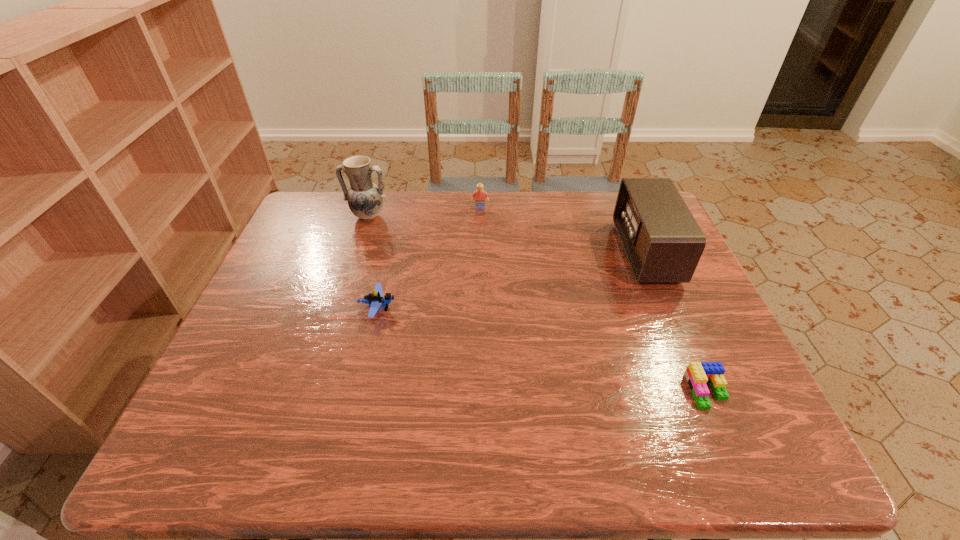
Find the location of a particular element. The height and width of the screenshot is (540, 960). free location located on the front-facing side of the radio receiver is located at coordinates (510, 253).

Find the location of a particular element. Image resolution: width=960 pixels, height=540 pixels. vacant region located on the front-facing side of the radio receiver is located at coordinates (534, 253).

Identify the location of vacant position located 0.170m on the front-facing side of the second Lego from right to left. This screenshot has height=540, width=960. (480, 244).

Where is `free location located 0.180m on the front-facing side of the leftmost Lego`? The image size is (960, 540). free location located 0.180m on the front-facing side of the leftmost Lego is located at coordinates (469, 309).

At what (x,y) coordinates should I click in order to perform the action: click on vacant space located 0.220m on the back of the shortest Lego. Please return your answer as a coordinate pair (x, y). Looking at the image, I should click on (668, 300).

At what (x,y) coordinates should I click in order to perform the action: click on pottery present at the far edge. Please return your answer as a coordinate pair (x, y). Image resolution: width=960 pixels, height=540 pixels. Looking at the image, I should click on (365, 199).

This screenshot has height=540, width=960. I want to click on radio receiver located at the far edge, so click(x=663, y=243).

I want to click on Lego present at the far edge, so click(479, 195).

Where is `object that is at the left edge`? The image size is (960, 540). object that is at the left edge is located at coordinates (365, 199).

Find the location of `radio receiver positioned at the right edge`. radio receiver positioned at the right edge is located at coordinates click(x=663, y=243).